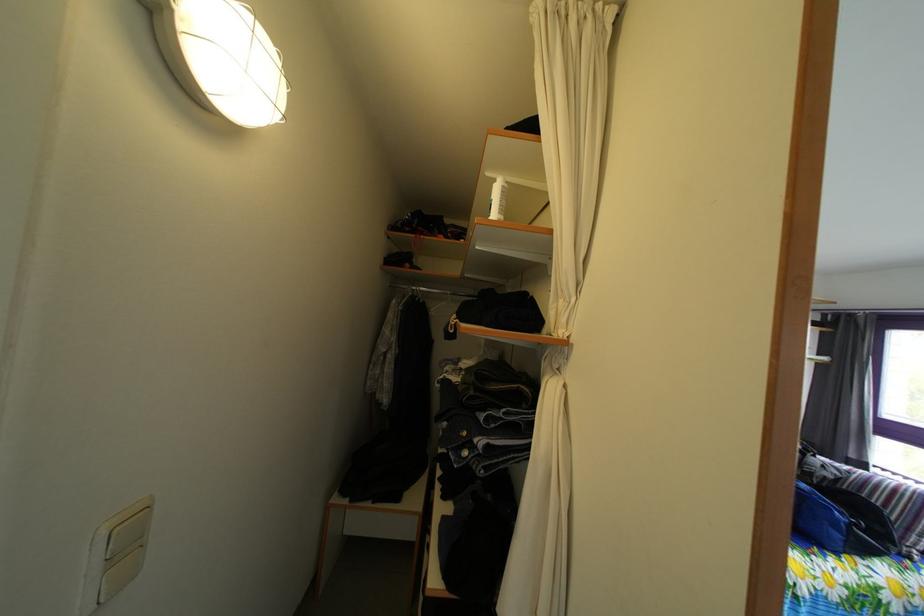
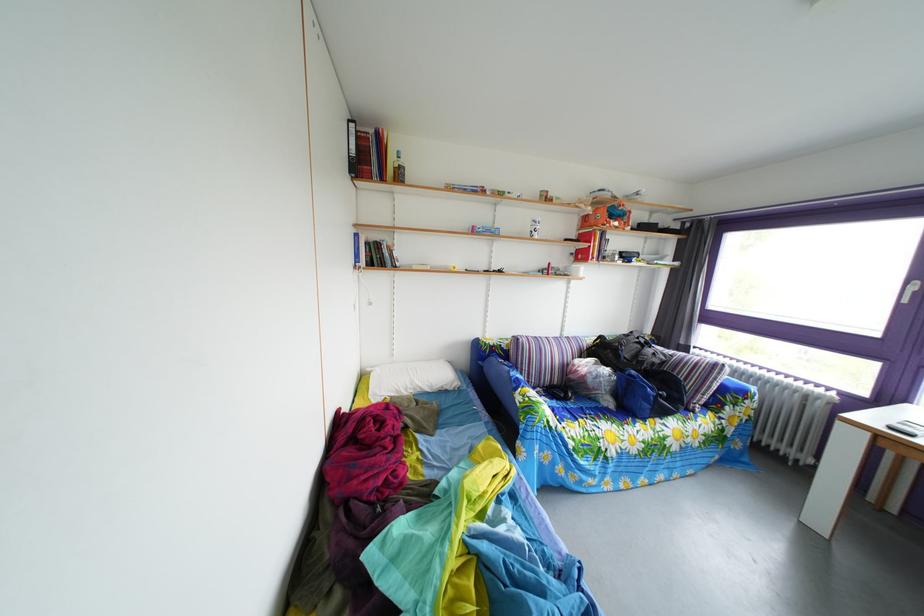
Question: In a continuous first-person perspective shot, in which direction is the camera moving?

Choices:
 (A) Left
 (B) Right
 (C) Forward
 (D) Backward

Answer: (B)